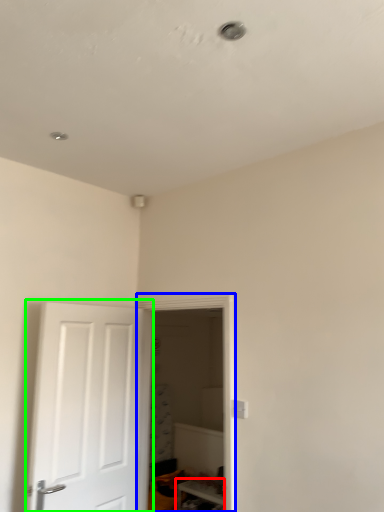
Question: Based on their relative distances, which object is nearer to furniture (highlighted by a red box)? Choose from glass door (highlighted by a blue box) and door (highlighted by a green box).

Choices:
 (A) glass door
 (B) door

Answer: (B)